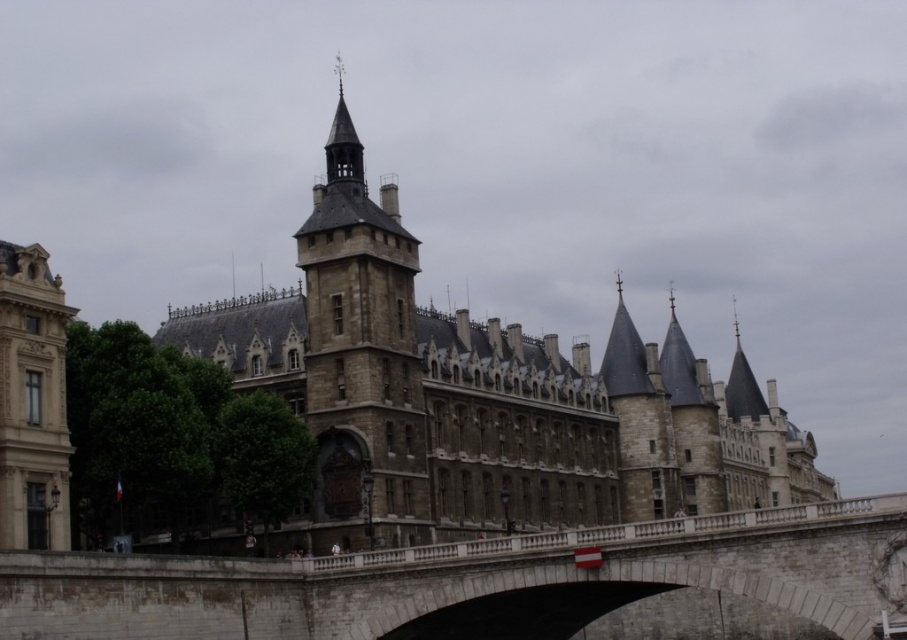
Between stone castle at center and brown stone tower at center, which one is positioned higher?

brown stone tower at center is above.

Can you confirm if stone castle at center is taller than brown stone tower at center?

In fact, stone castle at center may be shorter than brown stone tower at center.

Which is behind, point (629, 467) or point (361, 467)?

The point (629, 467) is behind.

Locate an element on the screen. stone castle at center is located at coordinates (480, 396).

In the scene shown: Can you confirm if stone bridge at center is positioned below stone tower at left?

Yes, stone bridge at center is below stone tower at left.

Who is positioned more to the right, stone bridge at center or stone tower at left?

Positioned to the right is stone bridge at center.

Between point (233, 580) and point (54, 321), which one is positioned in front?

Positioned in front is point (54, 321).

This screenshot has height=640, width=907. I want to click on stone bridge at center, so click(x=476, y=580).

Which is in front, point (405, 504) or point (17, 307)?

Positioned in front is point (17, 307).

Consider the image. Can you confirm if brown stone tower at center is positioned to the left of stone tower at left?

In fact, brown stone tower at center is to the right of stone tower at left.

Does point (393, 346) come in front of point (11, 401)?

No, it is not.

Where is `brown stone tower at center`? brown stone tower at center is located at coordinates (362, 352).